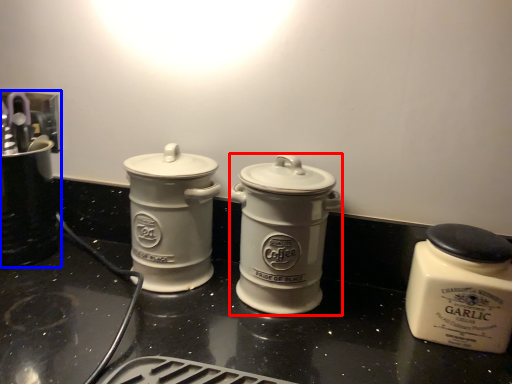
Question: Among these objects, which one is farthest to the camera, kitchen appliance (highlighted by a red box) or appliance (highlighted by a blue box)?

Choices:
 (A) kitchen appliance
 (B) appliance

Answer: (B)